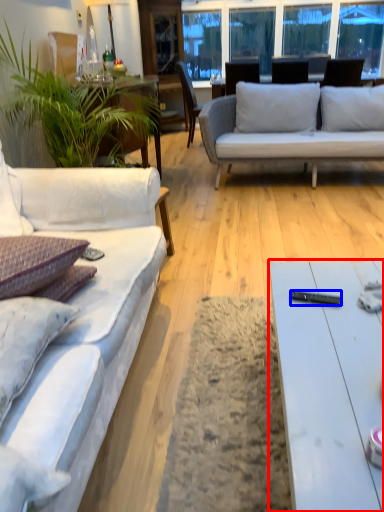
Question: Among these objects, which one is nearest to the camera, coffee table (highlighted by a red box) or remote control (highlighted by a blue box)?

Choices:
 (A) coffee table
 (B) remote control

Answer: (A)